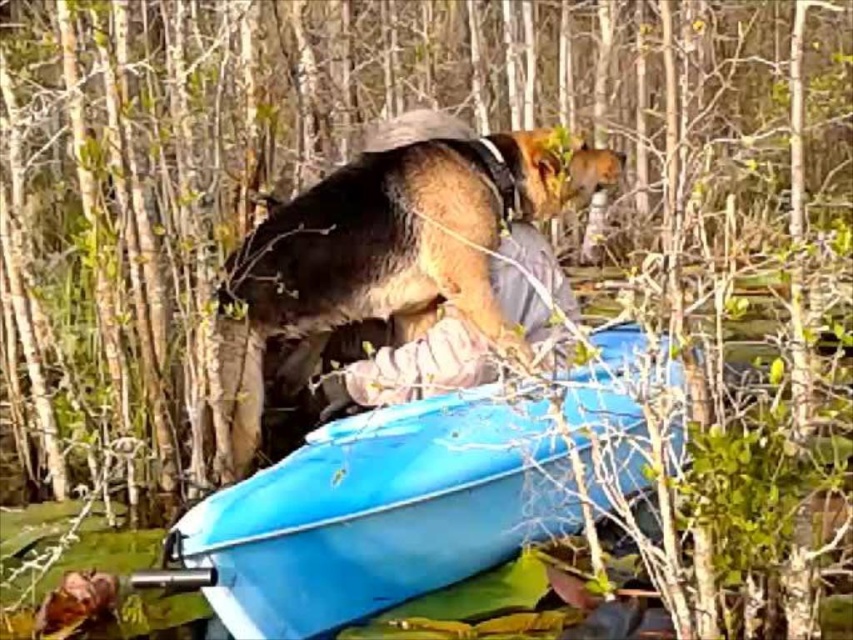
Question: Can you confirm if blue plastic boat at center is bigger than brown fur dog at center?

Choices:
 (A) yes
 (B) no

Answer: (A)

Question: Is the position of blue plastic boat at center more distant than that of brown fur dog at center?

Choices:
 (A) yes
 (B) no

Answer: (B)

Question: Can you confirm if blue plastic boat at center is wider than brown fur dog at center?

Choices:
 (A) yes
 (B) no

Answer: (B)

Question: Which object is farther from the camera taking this photo?

Choices:
 (A) blue plastic boat at center
 (B) brown fur dog at center

Answer: (B)